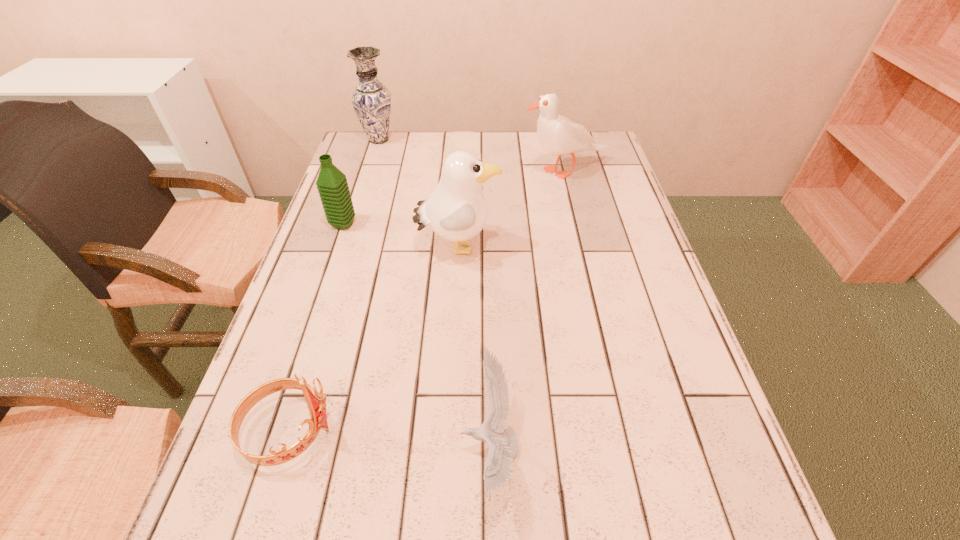
Find the location of a particular element. blank space located at the beak of the rightmost gull is located at coordinates (471, 171).

In order to click on vacant space located 0.090m at the beak of the rightmost gull in this screenshot , I will do `click(492, 171)`.

Image resolution: width=960 pixels, height=540 pixels. Identify the location of free location located 0.300m at the beak of the rightmost gull. (422, 171).

This screenshot has height=540, width=960. I want to click on vacant region located 0.120m on the right of the water bottle, so click(401, 224).

This screenshot has height=540, width=960. In order to click on vacant space located on the front-facing side of the tiara in this screenshot , I will do `click(534, 431)`.

Identify the location of free space located at the tip of the beak of the nearest gull. The image size is (960, 540). (327, 447).

Find the location of a particular element. The width and height of the screenshot is (960, 540). free spot located 0.300m at the tip of the beak of the nearest gull is located at coordinates (287, 447).

Where is `vacant area situated 0.130m at the tip of the beak of the nearest gull`? The image size is (960, 540). vacant area situated 0.130m at the tip of the beak of the nearest gull is located at coordinates (385, 447).

The height and width of the screenshot is (540, 960). What are the coordinates of `vase located in the far edge section of the desktop` in the screenshot? It's located at (371, 100).

Identify the location of gull at the far edge. (557, 135).